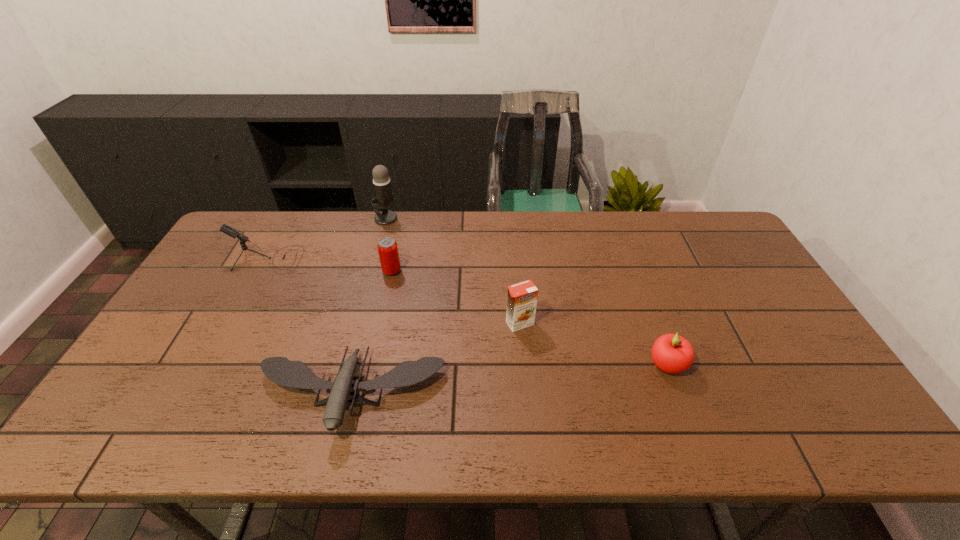
You are a GUI agent. You are given a task and a screenshot of the screen. Output one action in this format:
    pyautogui.click(x=<x>, y=<y>)
    Task: Click on the free space at the right edge
    The image size is (960, 540).
    Given the screenshot: What is the action you would take?
    pyautogui.click(x=736, y=325)

Where is `vacant space at the far left corner of the desktop`? The width and height of the screenshot is (960, 540). vacant space at the far left corner of the desktop is located at coordinates (263, 215).

You are a GUI agent. You are given a task and a screenshot of the screen. Output one action in this format:
    pyautogui.click(x=<x>, y=<y>)
    Task: Click on the blank space at the far right corner
    Image resolution: width=960 pixels, height=540 pixels.
    Given the screenshot: What is the action you would take?
    pyautogui.click(x=683, y=215)

Where is `free location at the near right corner`? The height and width of the screenshot is (540, 960). free location at the near right corner is located at coordinates (813, 413).

What are the coordinates of `vacant space that is in between the drone and the shorter microphone` in the screenshot? It's located at (308, 327).

Find the location of a particular element. The image size is (960, 540). empty location between the shortest object and the nearer microphone is located at coordinates (308, 327).

At what (x,y) coordinates should I click in order to perform the action: click on free space between the leftmost object and the can. Please return your answer as a coordinate pair (x, y). Looking at the image, I should click on (329, 265).

At what (x,y) coordinates should I click in order to perform the action: click on free area in between the orange juice and the can. Please return your answer as a coordinate pair (x, y). This screenshot has width=960, height=540. Looking at the image, I should click on (456, 297).

Image resolution: width=960 pixels, height=540 pixels. In order to click on unoccupied position between the rightmost object and the fourth farthest object in this screenshot , I will do `click(593, 344)`.

Identify the location of vacant space in between the can and the leftmost object. (329, 265).